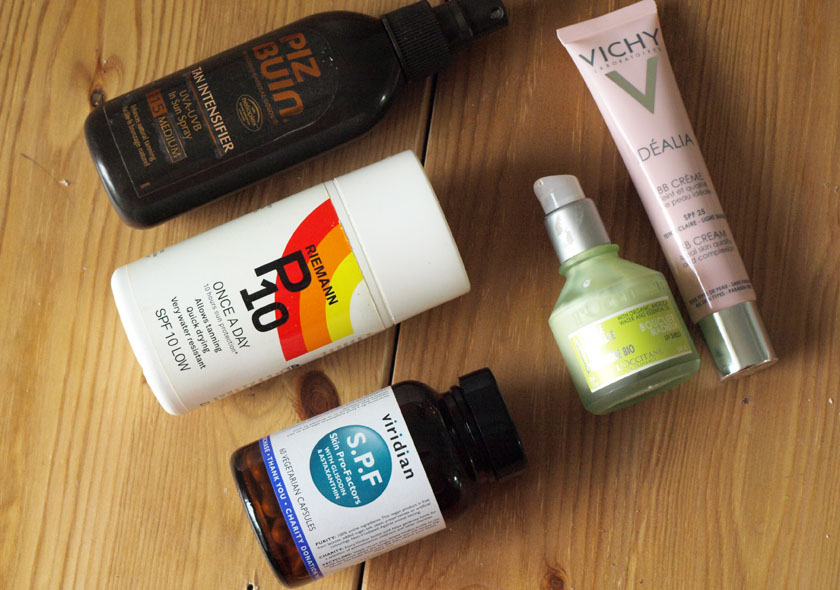
At what (x,y) coordinates should I click in order to perform the action: click on 1 silver lid. Please return your answer as a coordinate pair (x, y). Looking at the image, I should click on (744, 349).